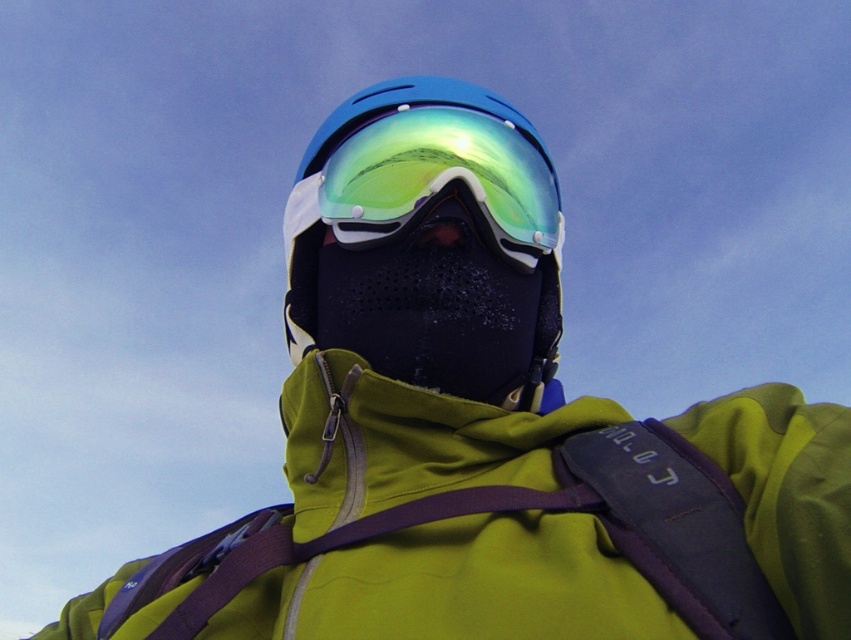
Question: Can you confirm if blue matte helmet at center is positioned to the left of green reflective lens at center?

Choices:
 (A) no
 (B) yes

Answer: (B)

Question: Which of the following is the closest to the observer?

Choices:
 (A) blue matte helmet at center
 (B) green reflective lens at center

Answer: (A)

Question: Does blue matte helmet at center appear over green reflective lens at center?

Choices:
 (A) no
 (B) yes

Answer: (A)

Question: Is blue matte helmet at center further to the viewer compared to green reflective lens at center?

Choices:
 (A) no
 (B) yes

Answer: (A)

Question: Which point is closer to the camera taking this photo?

Choices:
 (A) (478, 176)
 (B) (295, 220)

Answer: (A)